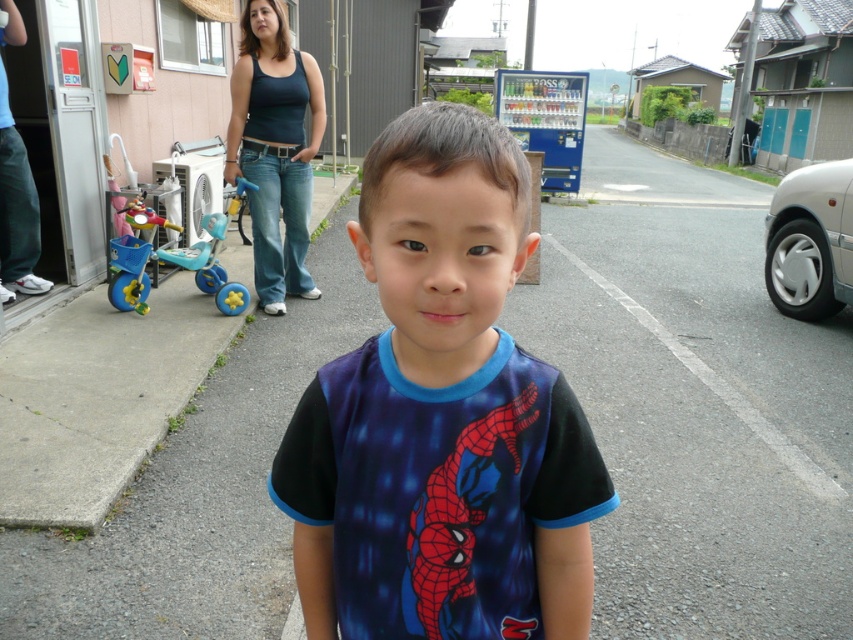
Question: Is blue printed t-shirt at center to the right of black cotton tank top at upper center from the viewer's perspective?

Choices:
 (A) yes
 (B) no

Answer: (A)

Question: Is gray asphalt pavement at center to the left of blue printed t-shirt at center from the viewer's perspective?

Choices:
 (A) yes
 (B) no

Answer: (B)

Question: Which object is the farthest from the gray asphalt pavement at center?

Choices:
 (A) blue printed t-shirt at center
 (B) black cotton tank top at upper center

Answer: (A)

Question: Which of the following is the closest to the observer?

Choices:
 (A) (325, 122)
 (B) (700, 298)

Answer: (B)

Question: Which point is closer to the camera taking this photo?

Choices:
 (A) (247, 45)
 (B) (796, 522)
 (C) (364, 380)

Answer: (C)

Question: Observing the image, what is the correct spatial positioning of gray asphalt pavement at center in reference to blue printed t-shirt at center?

Choices:
 (A) right
 (B) left

Answer: (A)